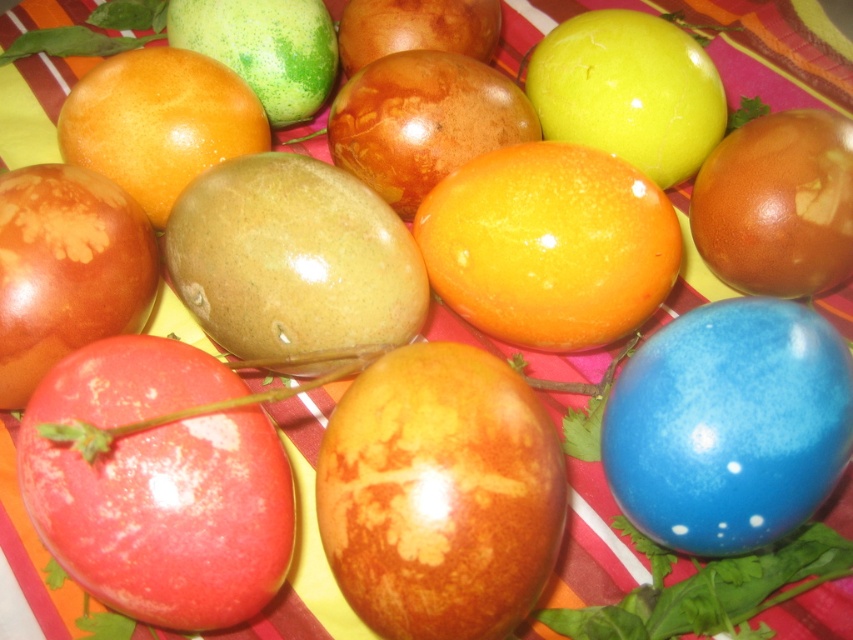
From the picture: Is brown marbled egg at center thinner than blue glossy egg at lower right?

Yes, brown marbled egg at center is thinner than blue glossy egg at lower right.

Looking at this image, who is more forward, (x=466, y=381) or (x=724, y=355)?

Positioned in front is point (x=466, y=381).

Find the location of a particular element. This screenshot has height=640, width=853. brown marbled egg at center is located at coordinates (440, 493).